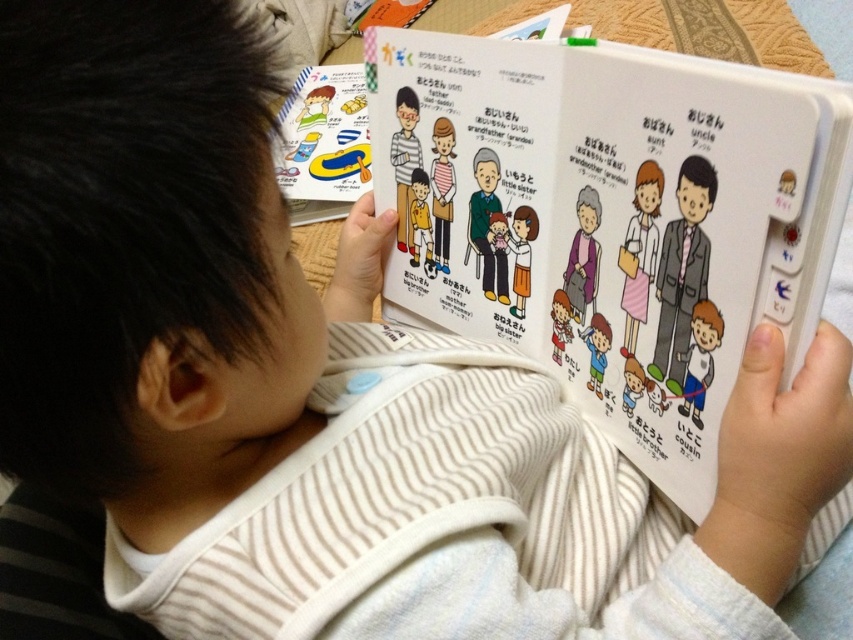
Question: Is matte plastic toy boat at upper left further to camera compared to purple fabric at center?

Choices:
 (A) no
 (B) yes

Answer: (B)

Question: Is purple fabric at center smaller than matte white dress at center?

Choices:
 (A) no
 (B) yes

Answer: (B)

Question: Among these points, which one is nearest to the camera?

Choices:
 (A) (589, 227)
 (B) (550, 150)

Answer: (A)

Question: Which point is closer to the camera?

Choices:
 (A) (363, 99)
 (B) (851, 156)
 (C) (524, 273)

Answer: (B)

Question: Based on their relative distances, which object is nearer to the matte plastic toy boat at upper left?

Choices:
 (A) white paper book at center
 (B) yellow matte shirt at center
 (C) matte white dress at center
 (D) purple fabric at center

Answer: (A)

Question: Can you confirm if matte plastic toy boat at upper left is thinner than yellow matte shirt at center?

Choices:
 (A) no
 (B) yes

Answer: (A)